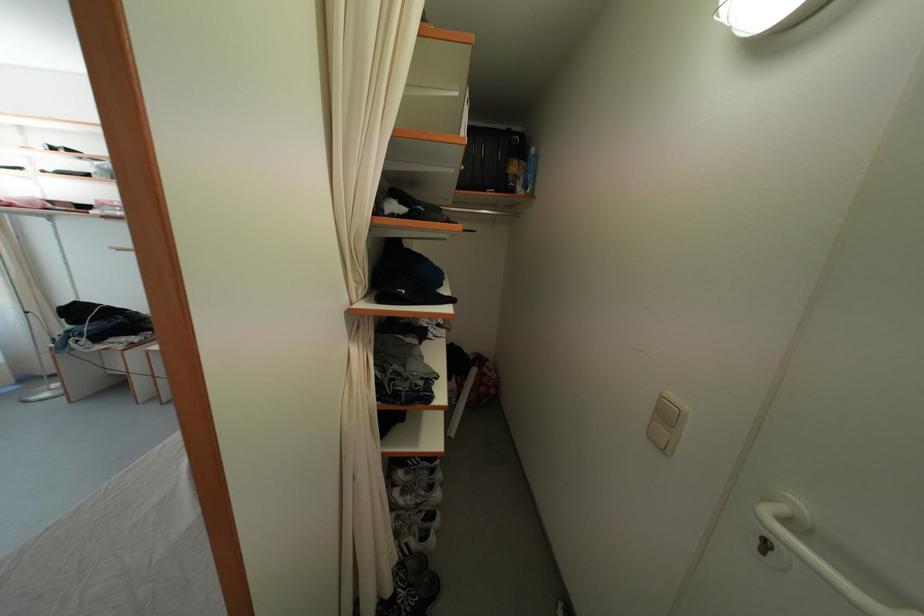
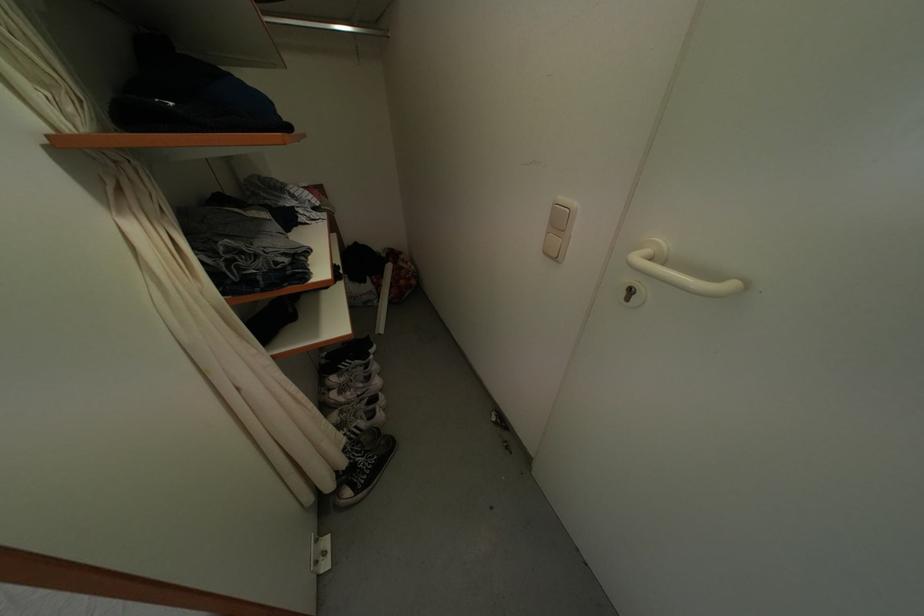
Find the pixel in the second image that matches point (415, 503) in the first image.

(354, 399)